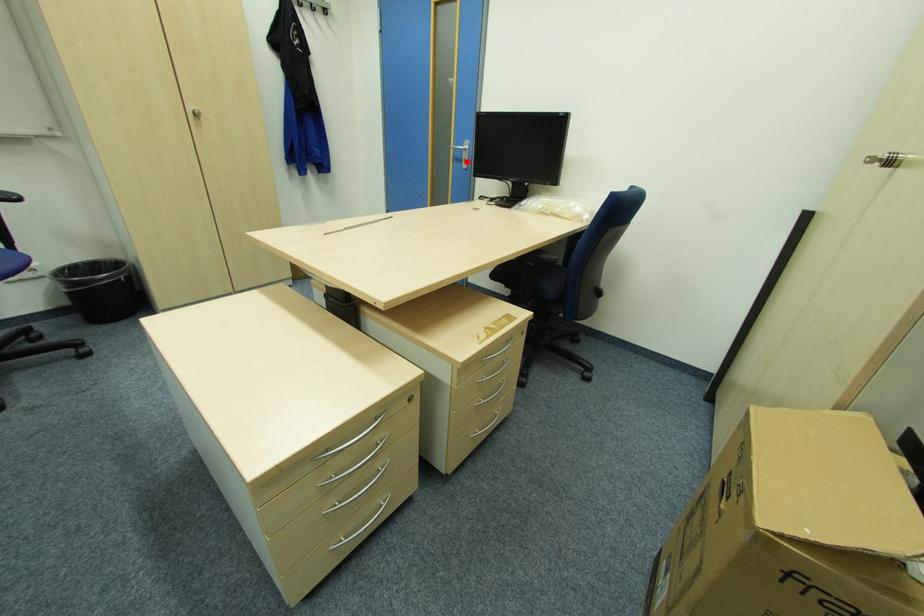
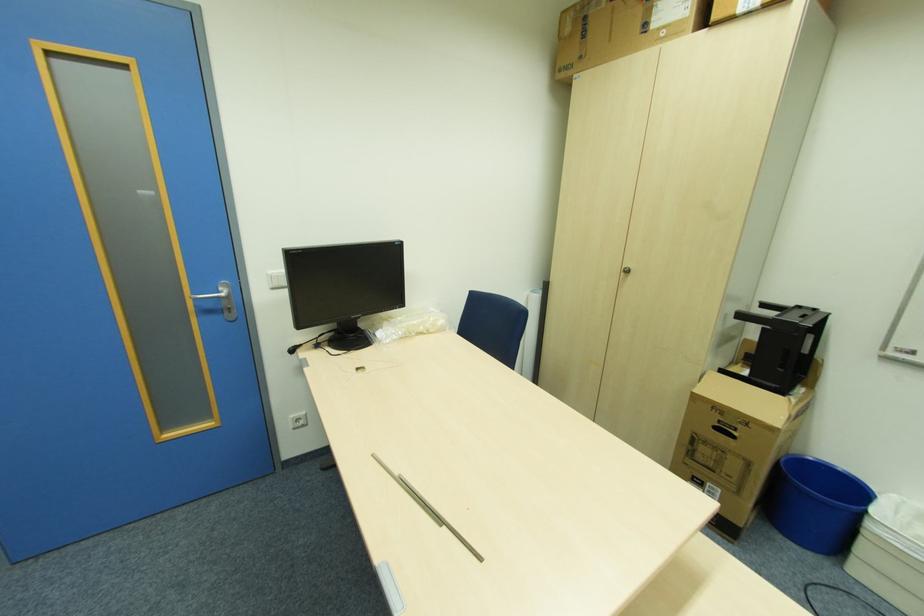
Question: I am providing you with two images of the same scene from different viewpoints. A red point is shown in image1. For the corresponding object point in image2, is it positioned nearer or farther from the camera?

Choices:
 (A) Nearer
 (B) Farther

Answer: (B)